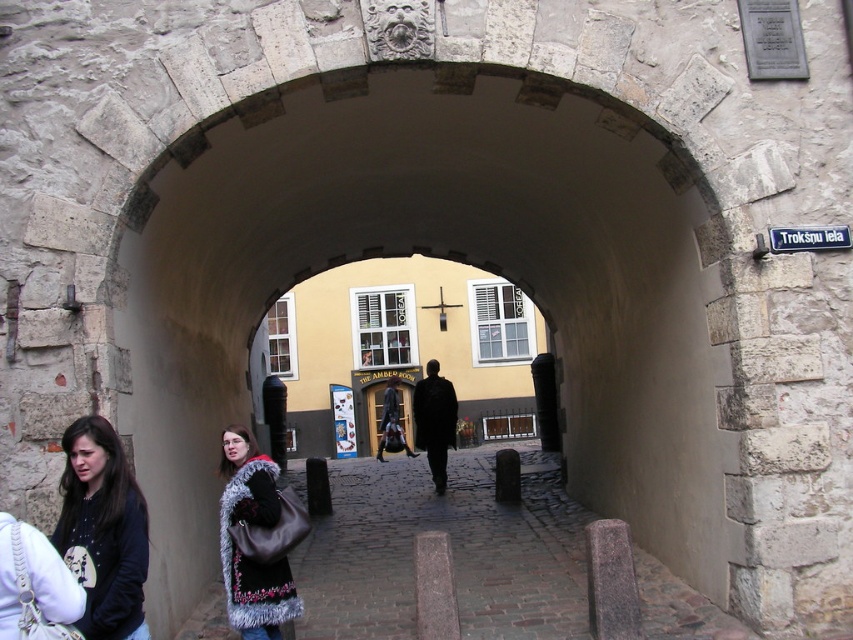
Question: Is dark brown hair at left positioned before fuzzy black coat at center?

Choices:
 (A) no
 (B) yes

Answer: (B)

Question: Which of these objects is positioned farthest from the stone archway at center?

Choices:
 (A) dark brown leather coat at center
 (B) dark brown hair at left

Answer: (A)

Question: Can you confirm if stone archway at center is positioned to the left of white plastic street sign at upper right?

Choices:
 (A) no
 (B) yes

Answer: (B)

Question: Does fuzzy black coat at center appear over white plastic street sign at upper right?

Choices:
 (A) no
 (B) yes

Answer: (A)

Question: Which of the following is the farthest from the observer?

Choices:
 (A) (221, 532)
 (B) (416, 384)

Answer: (B)

Question: Considering the real-world distances, which object is farthest from the fuzzy black coat at center?

Choices:
 (A) dark brown leather coat at center
 (B) stone archway at center
 (C) dark brown hair at left
 (D) white plastic street sign at upper right

Answer: (A)